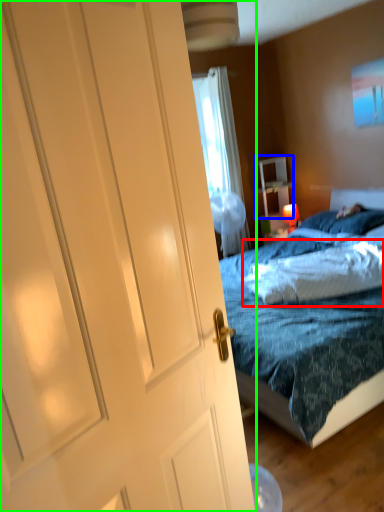
Question: Estimate the real-world distances between objects in this image. Which object is closer to pillow (highlighted by a red box), nightstand (highlighted by a blue box) or door (highlighted by a green box)?

Choices:
 (A) nightstand
 (B) door

Answer: (B)